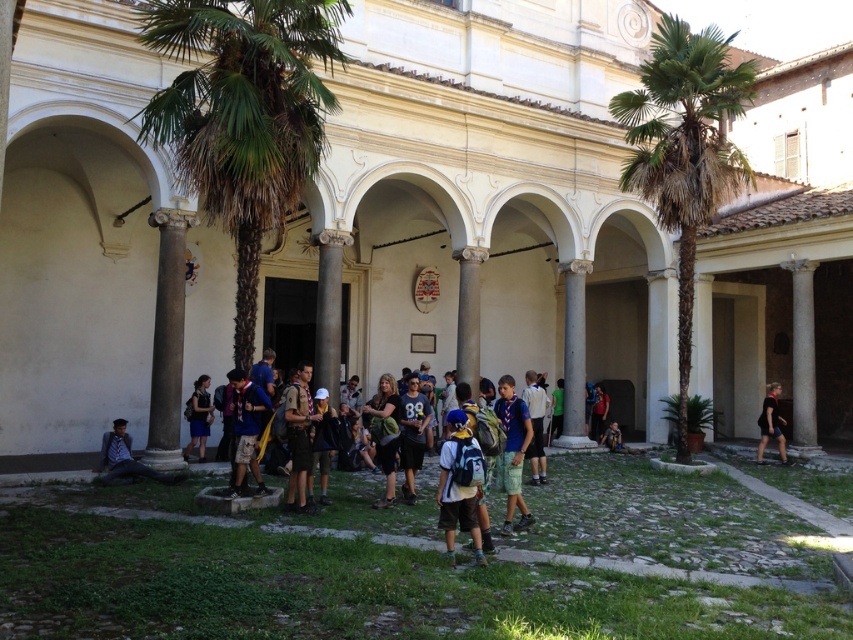
You are standing at the entrance of the courtyard and want to take a photo of the white smooth building at center. Which direction should you face to capture it in your camera frame?

Since the white smooth building at center is located at point coordinates 0.317 in the x axis and 0.562 in the y axis, you should face towards the central area of the courtyard to capture it in your camera frame.

From the picture: You are standing in the courtyard and want to place your matte black backpack at center near the white marble pillar at center. Based on their positions, which side of the pillar should you place the backpack on?

The white marble pillar at center is to the right of the matte black backpack at center, so you should place the backpack to the left side of the pillar.

You are a photographer trying to capture a photo of the white smooth building at center and the black fabric shirt at right. Since you want both subjects to be clearly visible in the frame, which object should you focus on first to ensure proper depth of field?

The white smooth building at center should be focused on first because it has a greater height compared to the black fabric shirt at right, ensuring both are in focus when starting with the taller subject.